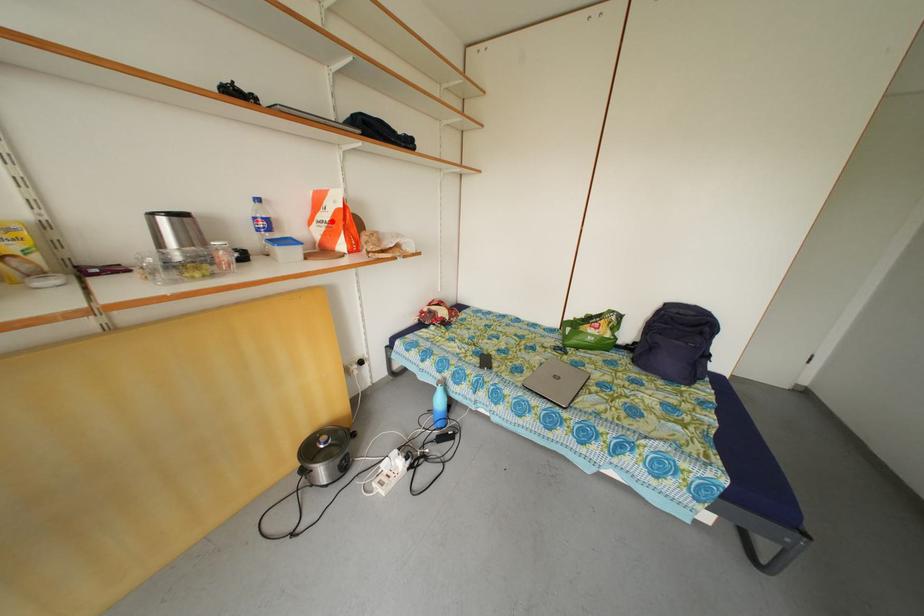
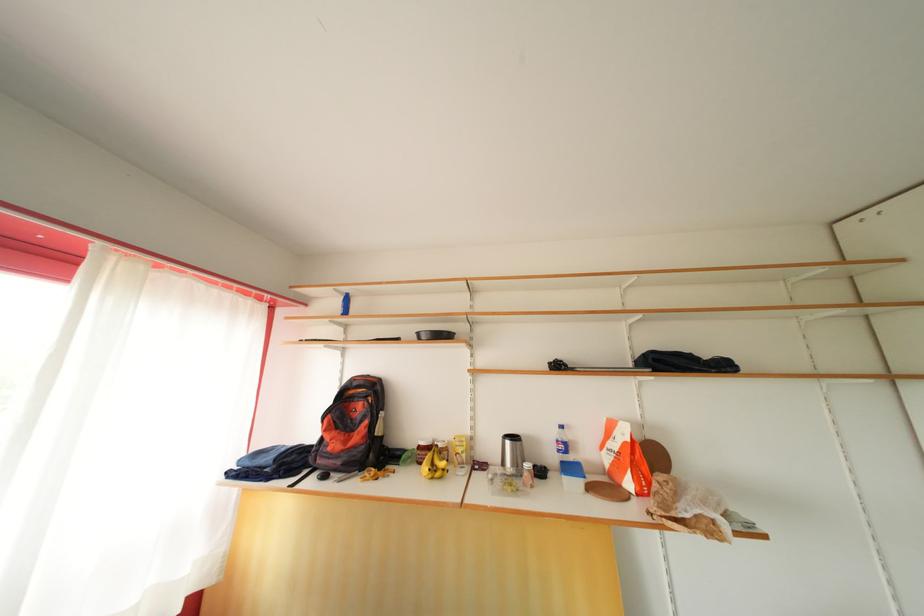
In the second image, find the point that corresponds to the highlighted location in the first image.

(622, 451)